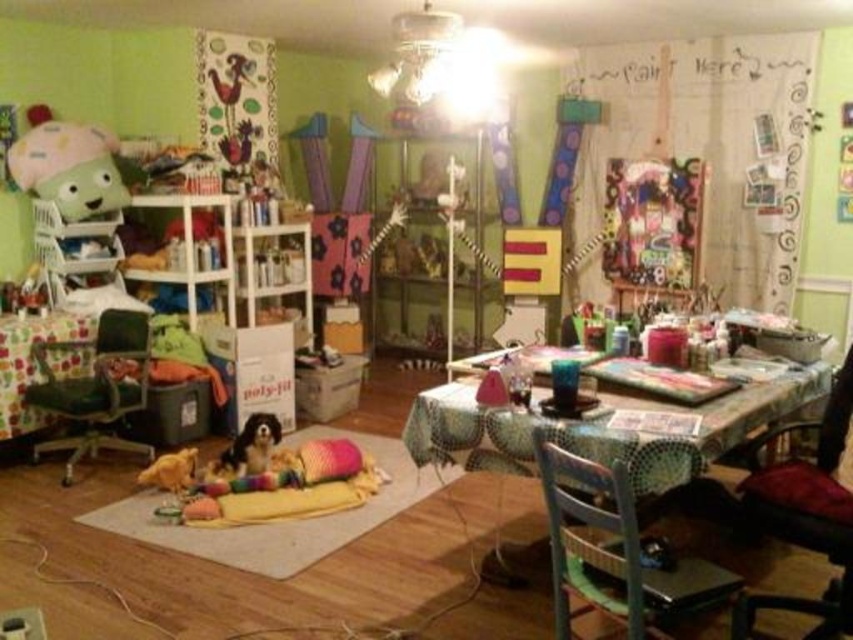
Question: Can you confirm if wooden chair at lower right is wider than velvet red chair at lower right?

Choices:
 (A) yes
 (B) no

Answer: (B)

Question: Which point is closer to the camera taking this photo?

Choices:
 (A) (57, 410)
 (B) (20, 392)

Answer: (A)

Question: Which point is farther from the camera taking this photo?

Choices:
 (A) (242, 440)
 (B) (55, 365)
 (C) (810, 518)

Answer: (B)

Question: Is patterned fabric table at center positioned in front of wooden chair at lower right?

Choices:
 (A) no
 (B) yes

Answer: (A)

Question: Does velvet red chair at lower right have a smaller size compared to green fabric office chair at left?

Choices:
 (A) yes
 (B) no

Answer: (B)

Question: Which point is closer to the camera?

Choices:
 (A) wooden chair at lower right
 (B) velvet red chair at lower right
 (C) polka dot fabric table at center
 (D) black fur dog at lower center

Answer: (A)